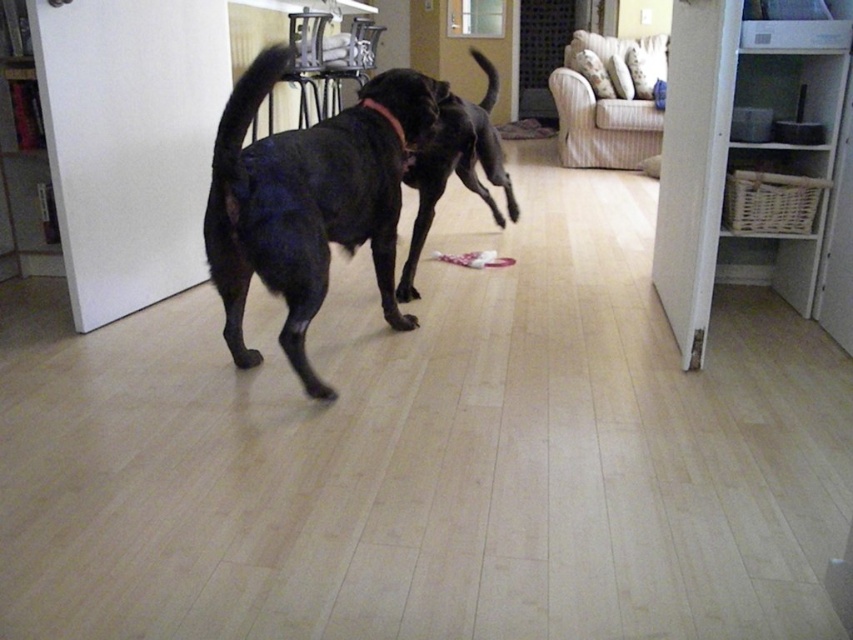
You are standing in the room and want to pick up an object. There are two points marked in the scene, point (x=236, y=189) and point (x=500, y=186). Which point is closer to you?

Point (x=236, y=189) is closer to the viewer than point (x=500, y=186).

You are standing at the point marked as point (x=393, y=323) in the image. You want to throw a ball to the black dog that is mid stride to the right. Considering the distance between you and the black dog is 9.01 feet, will the ball reach the dog if you can throw up to 10 feet?

The distance between you and the black dog is 9.01 feet, and since you can throw up to 10 feet, the ball will reach the dog.